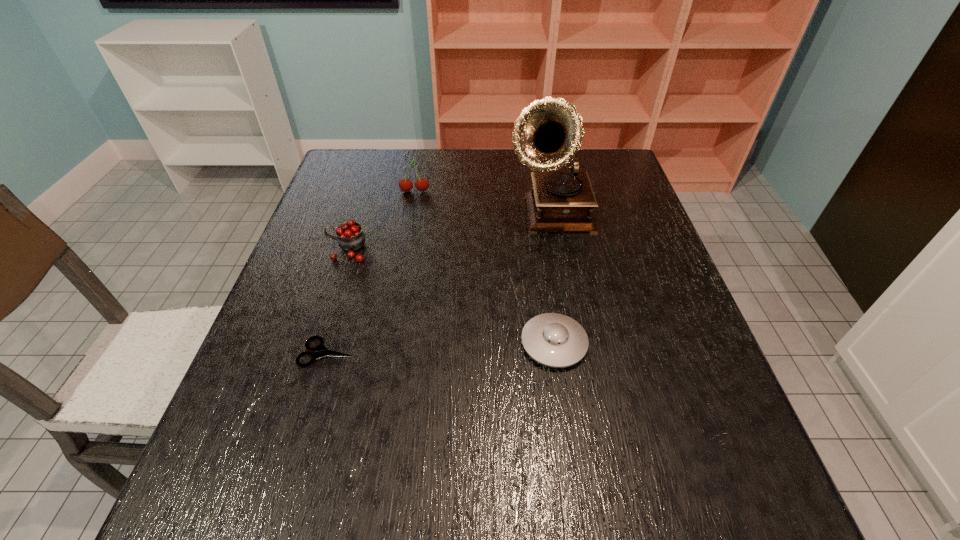
Choose which object is the third nearest neighbor to the tallest object. Please provide its 2D coordinates. Your answer should be formatted as a tuple, i.e. [(x, y)], where the tuple contains the x and y coordinates of a point satisfying the conditions above.

[(350, 237)]

Identify which object is the nearest to the nearer cherry. Please provide its 2D coordinates. Your answer should be formatted as a tuple, i.e. [(x, y)], where the tuple contains the x and y coordinates of a point satisfying the conditions above.

[(421, 184)]

In order to click on vacant region that satisfies the following two spatial constraints: 1. on the surface of the saucer; 2. on the right side of the third object from right to left in this screenshot , I will do `click(387, 343)`.

Image resolution: width=960 pixels, height=540 pixels. In order to click on blank area in the image that satisfies the following two spatial constraints: 1. on the surface of the second shortest object; 2. on the right side of the third object from left to right in this screenshot , I will do `click(387, 343)`.

Where is `free space in the image that satisfies the following two spatial constraints: 1. on the surface of the saucer; 2. on the right side of the farther cherry`? The height and width of the screenshot is (540, 960). free space in the image that satisfies the following two spatial constraints: 1. on the surface of the saucer; 2. on the right side of the farther cherry is located at coordinates (387, 343).